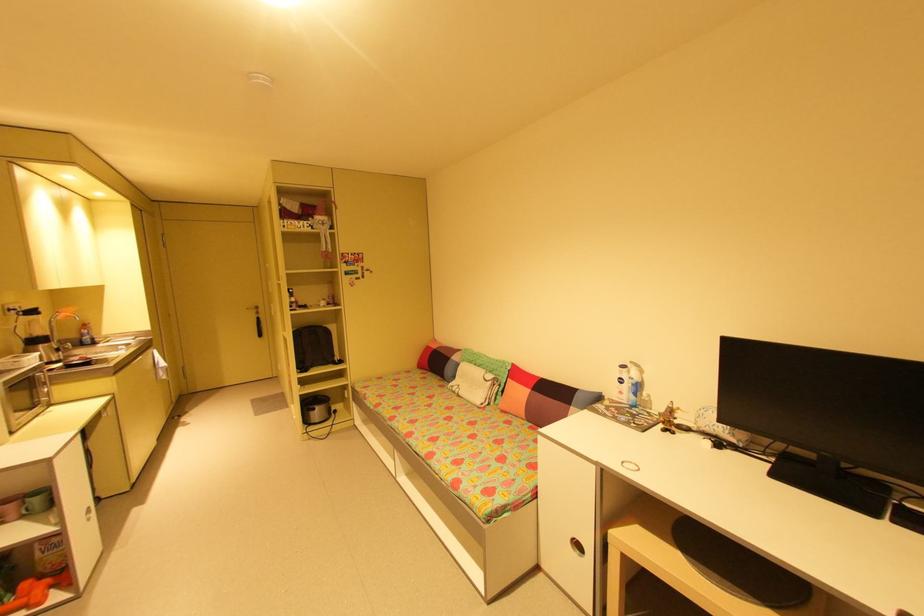
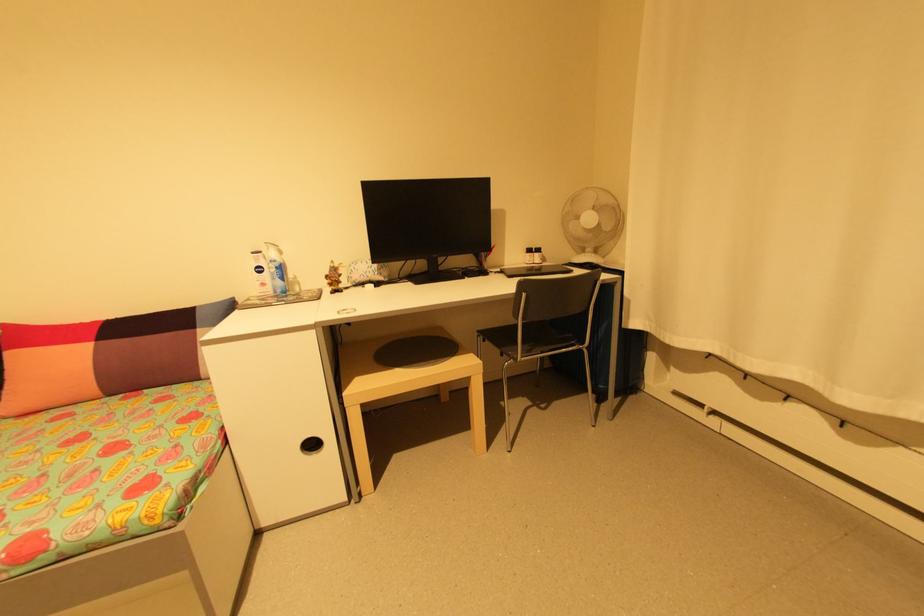
Where in the second image is the point corresponding to [633,400] from the first image?

(280, 291)